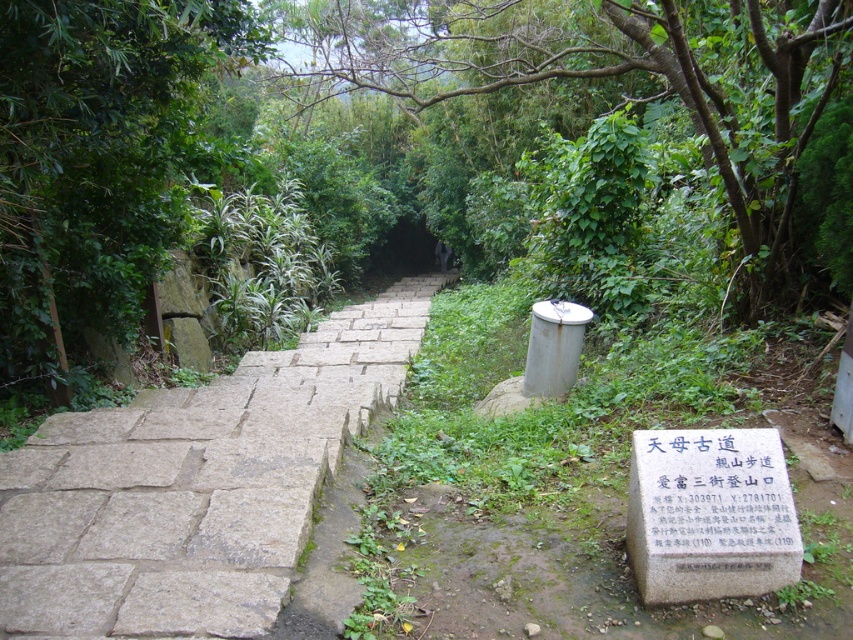
Based on the photo, does green leafy tree at left appear under white stone sign at lower right?

Actually, green leafy tree at left is above white stone sign at lower right.

Between green leafy tree at left and white stone sign at lower right, which one appears on the right side from the viewer's perspective?

white stone sign at lower right

The image size is (853, 640). What are the coordinates of `green leafy tree at left` in the screenshot? It's located at (99, 161).

Does green leafy tree at center appear on the left side of white stone sign at lower right?

Indeed, green leafy tree at center is positioned on the left side of white stone sign at lower right.

Is point (627, 13) closer to viewer compared to point (781, 561)?

No, it is not.

Is point (440, 204) more distant than point (769, 433)?

That is True.

This screenshot has width=853, height=640. What are the coordinates of `green leafy tree at center` in the screenshot? It's located at (607, 77).

Can you confirm if gray stone steps at center is positioned above white stone sign at lower right?

Indeed, gray stone steps at center is positioned over white stone sign at lower right.

Can you confirm if gray stone steps at center is positioned to the left of white stone sign at lower right?

Yes, gray stone steps at center is to the left of white stone sign at lower right.

Locate an element on the screen. The width and height of the screenshot is (853, 640). gray stone steps at center is located at coordinates (195, 484).